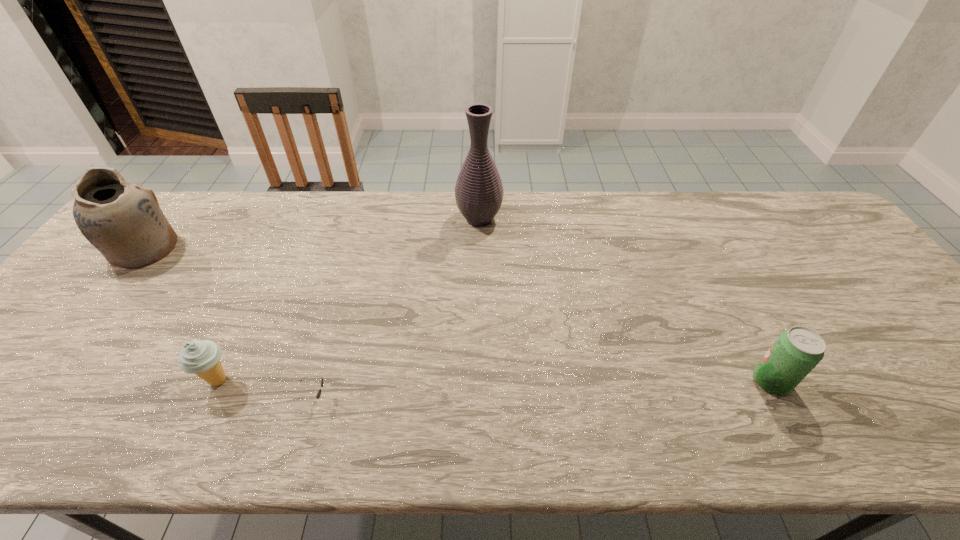
Find the location of a particular element. The height and width of the screenshot is (540, 960). vacant space that is in between the rightmost object and the second object from left to right is located at coordinates (494, 381).

The width and height of the screenshot is (960, 540). I want to click on empty space that is in between the icecream and the vase, so click(348, 300).

Identify which object is located as the nearest to the vase. Please provide its 2D coordinates. Your answer should be formatted as a tuple, i.e. [(x, y)], where the tuple contains the x and y coordinates of a point satisfying the conditions above.

[(318, 395)]

Identify which object is located as the fourth nearest to the soda. Please provide its 2D coordinates. Your answer should be formatted as a tuple, i.e. [(x, y)], where the tuple contains the x and y coordinates of a point satisfying the conditions above.

[(122, 220)]

This screenshot has width=960, height=540. Identify the location of free location that satisfies the following two spatial constraints: 1. on the front side of the soda; 2. on the right side of the second tallest object. (40, 381).

Identify the location of vacant space that satisfies the following two spatial constraints: 1. on the front side of the tallest object; 2. on the left side of the soda. (x=479, y=381).

Locate an element on the screen. Image resolution: width=960 pixels, height=540 pixels. free space that satisfies the following two spatial constraints: 1. on the front side of the icecream; 2. on the right side of the leftmost object is located at coordinates (41, 380).

You are a GUI agent. You are given a task and a screenshot of the screen. Output one action in this format:
    pyautogui.click(x=<x>, y=<y>)
    Task: Click on the free spot that satisfies the following two spatial constraints: 1. on the front side of the rightmost object; 2. on the left side of the vase
    Image resolution: width=960 pixels, height=540 pixels.
    Given the screenshot: What is the action you would take?
    pyautogui.click(x=479, y=381)